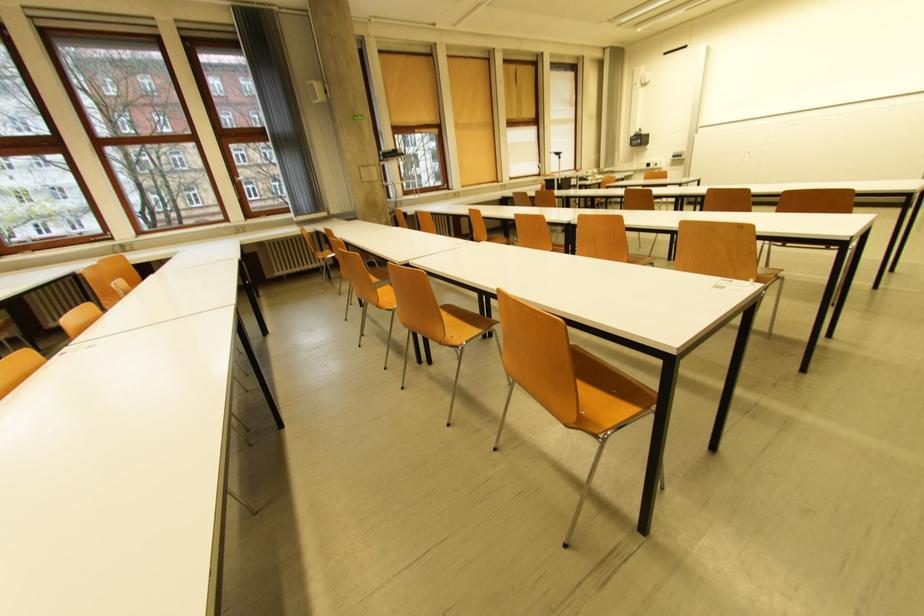
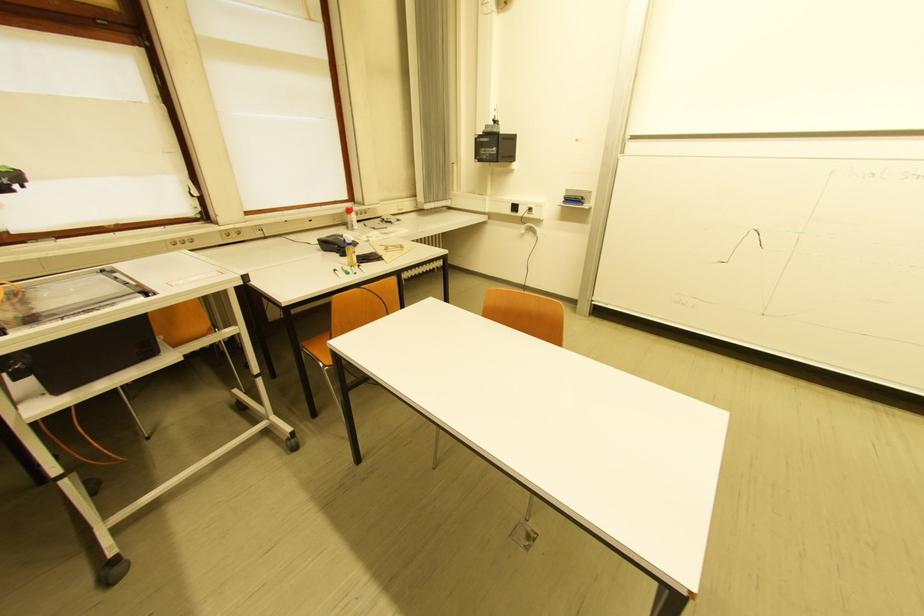
In the second image, find the point that corresponds to pixel 681 158 in the first image.

(575, 201)